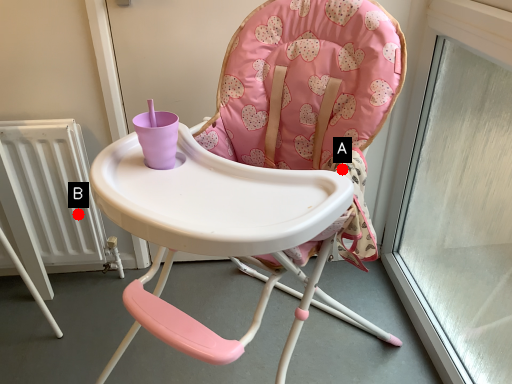
Question: Two points are circled on the image, labeled by A and B beside each circle. Which point is farther from the camera taking this photo?

Choices:
 (A) A is further
 (B) B is further

Answer: (B)